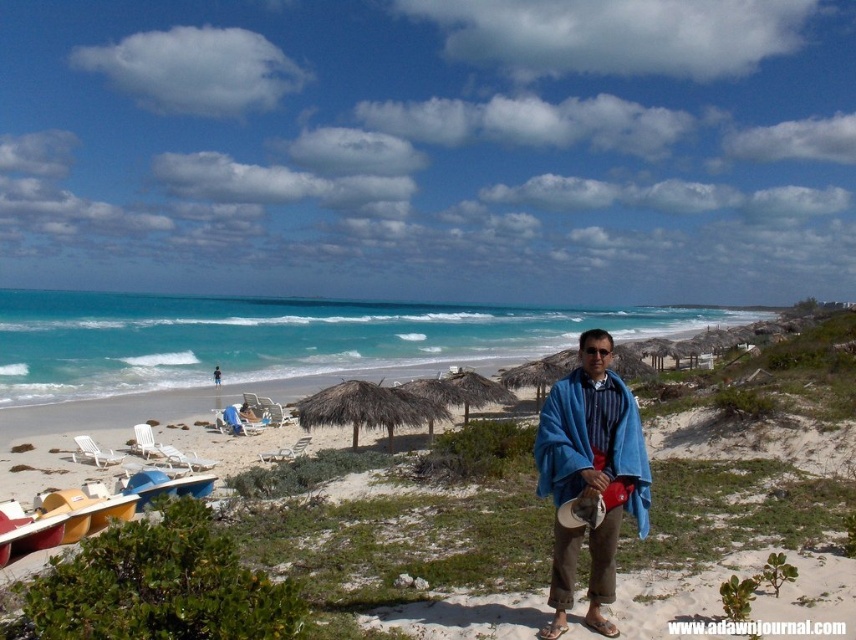
Is smooth sand beach at center to the right of blue fabric towel at center from the viewer's perspective?

Answer: In fact, smooth sand beach at center is to the left of blue fabric towel at center.

Which is more to the left, smooth sand beach at center or blue fabric towel at center?

From the viewer's perspective, smooth sand beach at center appears more on the left side.

Is point (813, 532) positioned after point (611, 465)?

Yes.

This screenshot has width=856, height=640. What are the coordinates of `smooth sand beach at center` in the screenshot? It's located at (415, 540).